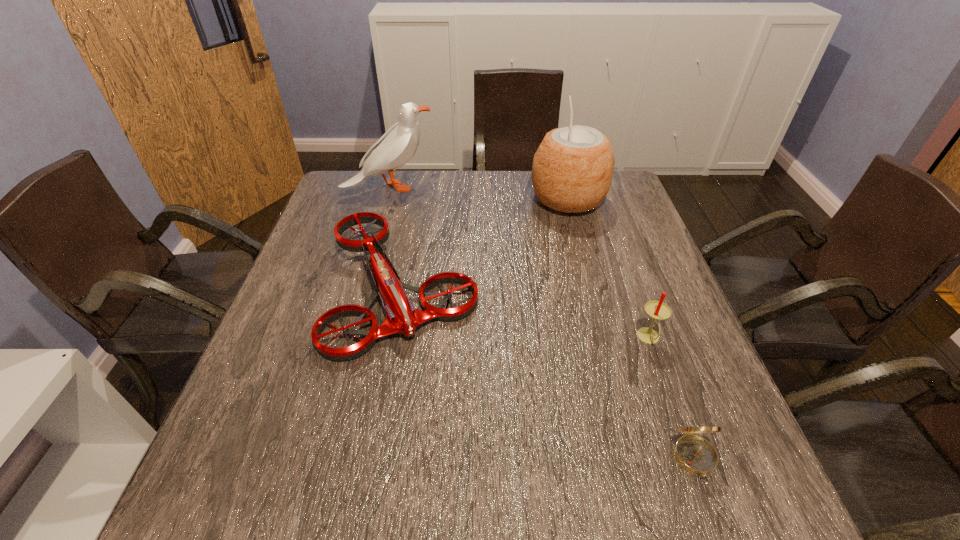
The width and height of the screenshot is (960, 540). Find the location of `vacant area that lies between the drone and the gull`. vacant area that lies between the drone and the gull is located at coordinates (396, 238).

Where is `free point between the nearest object and the candle`? free point between the nearest object and the candle is located at coordinates (672, 399).

The height and width of the screenshot is (540, 960). In order to click on free space between the coconut and the drone in this screenshot , I will do `click(485, 244)`.

Find the location of a particular element. free space between the nearest object and the third shortest object is located at coordinates (672, 399).

Find the location of `free space between the gull and the candle`. free space between the gull and the candle is located at coordinates (519, 263).

Where is `vacant area between the coconut and the drone`? vacant area between the coconut and the drone is located at coordinates (485, 244).

Locate an element on the screen. This screenshot has height=540, width=960. free spot between the gull and the drone is located at coordinates (396, 238).

Locate an element on the screen. Image resolution: width=960 pixels, height=540 pixels. unoccupied area between the drone and the compass is located at coordinates tap(548, 374).

Locate which object is the fourth closest to the gull. Please provide its 2D coordinates. Your answer should be formatted as a tuple, i.e. [(x, y)], where the tuple contains the x and y coordinates of a point satisfying the conditions above.

[(696, 455)]

Locate an element on the screen. object that is the closest to the drone is located at coordinates (398, 145).